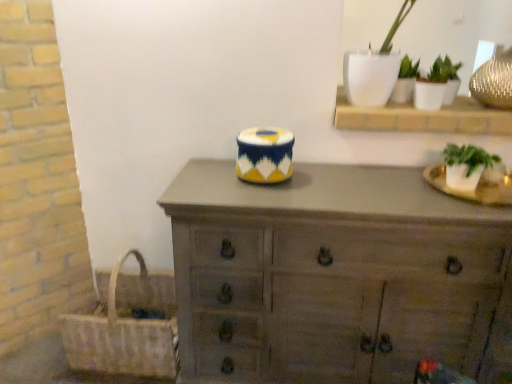
Question: Are green leafy plant in clear pot at right, the 3th houseplant from the top, and woven straw picnic basket at lower left beside each other?

Choices:
 (A) no
 (B) yes

Answer: (A)

Question: Considering the relative sizes of green leafy plant in clear pot at right, the 3th houseplant from the top, and woven straw picnic basket at lower left in the image provided, is green leafy plant in clear pot at right, the 3th houseplant from the top, shorter than woven straw picnic basket at lower left?

Choices:
 (A) no
 (B) yes

Answer: (B)

Question: Considering the relative positions of green leafy plant in clear pot at right, the 1th houseplant from the bottom, and woven straw picnic basket at lower left in the image provided, is green leafy plant in clear pot at right, the 1th houseplant from the bottom, to the left of woven straw picnic basket at lower left from the viewer's perspective?

Choices:
 (A) no
 (B) yes

Answer: (A)

Question: Considering the relative positions of green leafy plant in clear pot at right, the 3th houseplant from the top, and woven straw picnic basket at lower left in the image provided, is green leafy plant in clear pot at right, the 3th houseplant from the top, in front of woven straw picnic basket at lower left?

Choices:
 (A) no
 (B) yes

Answer: (B)

Question: Can woven straw picnic basket at lower left be found inside green leafy plant in clear pot at right, the 1th houseplant from the bottom?

Choices:
 (A) yes
 (B) no

Answer: (B)

Question: Does green leafy plant in clear pot at right, the 1th houseplant from the bottom, have a greater height compared to woven straw picnic basket at lower left?

Choices:
 (A) no
 (B) yes

Answer: (A)

Question: Can you confirm if white ceramic pot at upper right, the second houseplant positioned from the bottom, is shorter than green leafy plant in clear pot at right, the 3th houseplant from the top?

Choices:
 (A) yes
 (B) no

Answer: (B)

Question: From the image's perspective, would you say white ceramic pot at upper right, the second houseplant positioned from the bottom, is positioned over green leafy plant in clear pot at right, the 3th houseplant from the top?

Choices:
 (A) yes
 (B) no

Answer: (A)

Question: From a real-world perspective, is white ceramic pot at upper right, the second houseplant positioned from the bottom, below green leafy plant in clear pot at right, the 1th houseplant from the bottom?

Choices:
 (A) yes
 (B) no

Answer: (B)

Question: Are white ceramic pot at upper right, the second houseplant positioned from the bottom, and green leafy plant in clear pot at right, the 3th houseplant from the top, beside each other?

Choices:
 (A) yes
 (B) no

Answer: (B)

Question: Can you confirm if white ceramic pot at upper right, the second houseplant positioned from the bottom, is positioned to the right of green leafy plant in clear pot at right, the 3th houseplant from the top?

Choices:
 (A) yes
 (B) no

Answer: (B)

Question: Is green leafy plant in clear pot at right, the 3th houseplant from the top, inside white ceramic pot at upper right, which is the 2th houseplant in top-to-bottom order?

Choices:
 (A) no
 (B) yes

Answer: (A)

Question: Is woven straw picnic basket at lower left completely or partially outside of wooden chest of drawers at center?

Choices:
 (A) no
 (B) yes

Answer: (B)